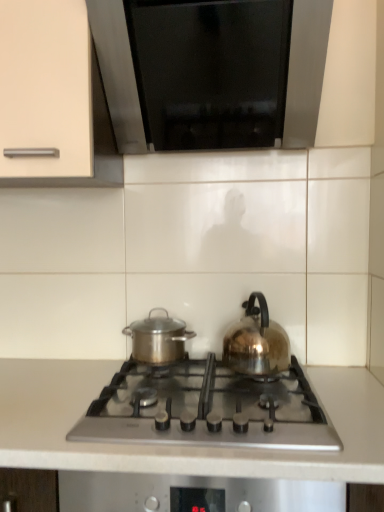
Question: In terms of size, does stainless steel pot at center appear bigger or smaller than translucent glass kettle at right?

Choices:
 (A) small
 (B) big

Answer: (A)

Question: From the image's perspective, is stainless steel pot at center above or below translucent glass kettle at right?

Choices:
 (A) below
 (B) above

Answer: (A)

Question: Which is nearer to the stainless steel pot at center?

Choices:
 (A) translucent glass kettle at right
 (B) black glass at upper center
 (C) white matte countertop at center
 (D) satin silver gas stove at center

Answer: (A)

Question: Which object is positioned closest to the stainless steel pot at center?

Choices:
 (A) translucent glass kettle at right
 (B) black glass at upper center
 (C) satin silver gas stove at center
 (D) white matte countertop at center

Answer: (A)